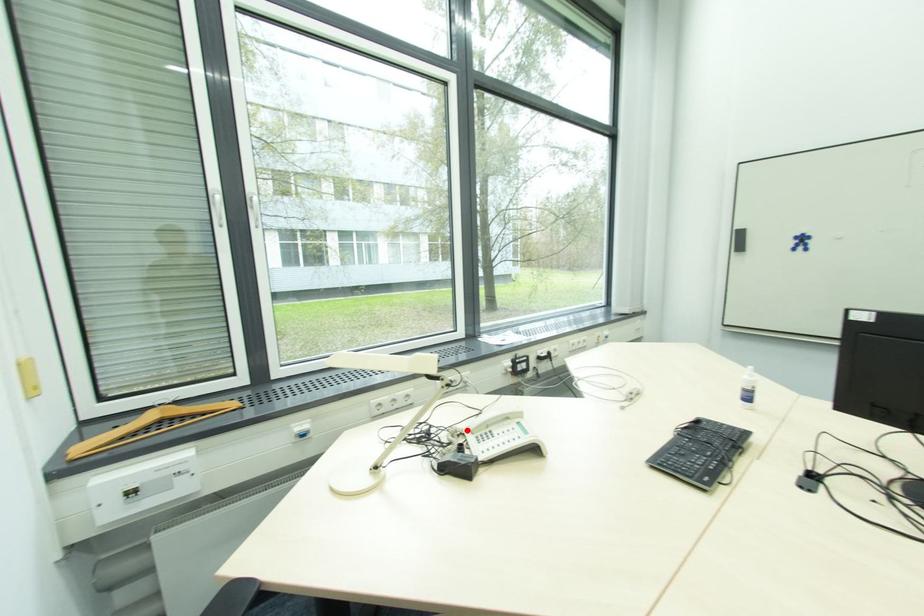
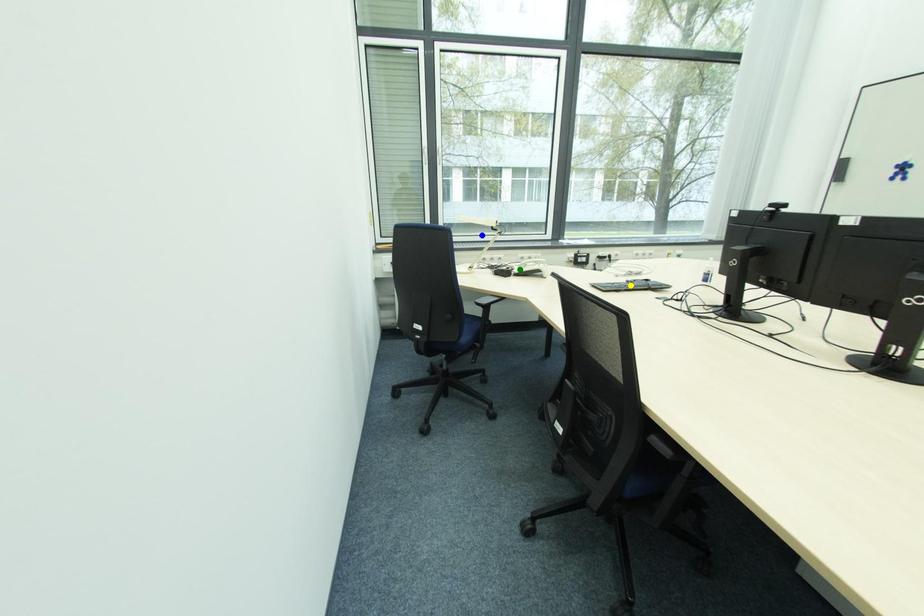
Question: I am providing you with two images of the same scene from different viewpoints. A red point is marked on the first image. You are given multiple points on the second image. In image 2, which mark is for the same physical point as the one in image 1?

Choices:
 (A) green point
 (B) yellow point
 (C) blue point

Answer: (A)